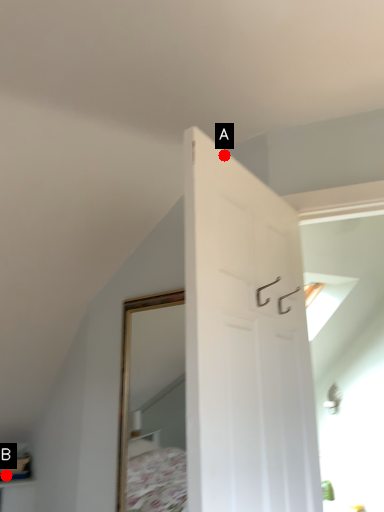
Question: Two points are circled on the image, labeled by A and B beside each circle. Which point is closer to the camera?

Choices:
 (A) A is closer
 (B) B is closer

Answer: (A)